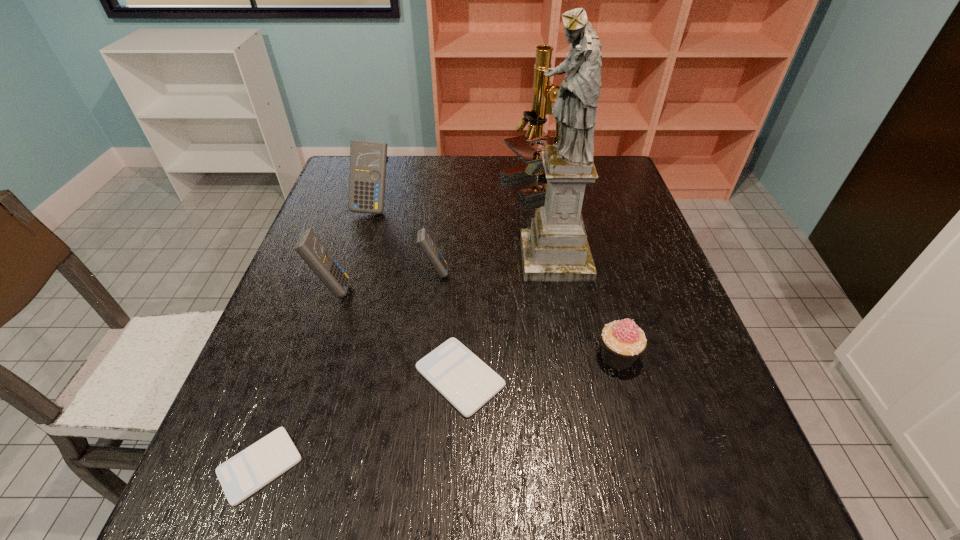
I want to click on cupcake, so click(x=622, y=342).

Find the location of `the second shortest calculator`. the second shortest calculator is located at coordinates pos(459,375).

Identify the location of the second nearest calculator. This screenshot has height=540, width=960. (459, 375).

This screenshot has width=960, height=540. What are the coordinates of `the shortest object` in the screenshot? It's located at (244, 474).

The height and width of the screenshot is (540, 960). I want to click on the nearest object, so click(244, 474).

The image size is (960, 540). I want to click on free spot located 0.170m on the front-facing side of the gray sculpture, so click(x=453, y=258).

Image resolution: width=960 pixels, height=540 pixels. What are the coordinates of `vacant region located on the front-facing side of the gray sculpture` in the screenshot? It's located at (493, 258).

Find the location of a particular element. free space located 0.240m on the front-facing side of the gray sculpture is located at coordinates (425, 258).

At what (x,y) coordinates should I click in order to perform the action: click on free space located 0.230m at the eyepiece of the microscope. Please return your answer as a coordinate pair (x, y). This screenshot has width=960, height=540. Looking at the image, I should click on (426, 185).

Locate an element on the screen. The height and width of the screenshot is (540, 960). blank space located 0.070m at the eyepiece of the microscope is located at coordinates (478, 185).